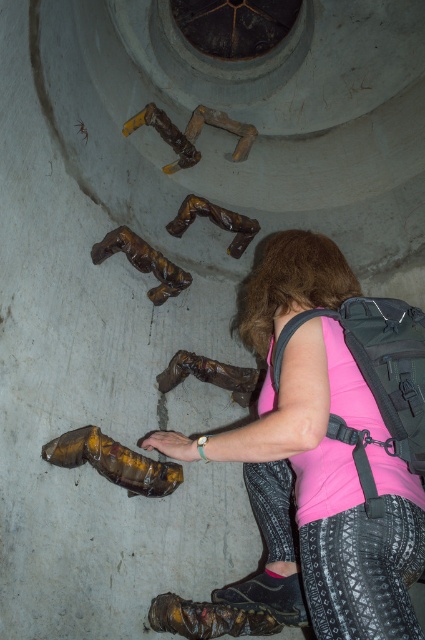
Can you confirm if pink fabric backpack at lower center is taller than leather glove at lower center?

Correct, pink fabric backpack at lower center is much taller as leather glove at lower center.

Between pink fabric backpack at lower center and leather glove at lower center, which one has more height?

With more height is pink fabric backpack at lower center.

This screenshot has height=640, width=425. What are the coordinates of `pink fabric backpack at lower center` in the screenshot? It's located at (329, 448).

Where is `pink fabric backpack at lower center`? pink fabric backpack at lower center is located at coordinates (329, 448).

In the scene shown: Can you confirm if pink fabric backpack at lower center is shorter than matte black backpack at center?

No, pink fabric backpack at lower center is not shorter than matte black backpack at center.

Between point (360, 461) and point (331, 422), which one is positioned in front?

Point (360, 461) is more forward.

The height and width of the screenshot is (640, 425). Identify the location of pink fabric backpack at lower center. (329, 448).

Between matte black backpack at center and leather glove at lower center, which one appears on the right side from the viewer's perspective?

matte black backpack at center is more to the right.

Is point (365, 355) more distant than point (169, 433)?

That is False.

Identify the location of matte black backpack at center. This screenshot has height=640, width=425. (377, 380).